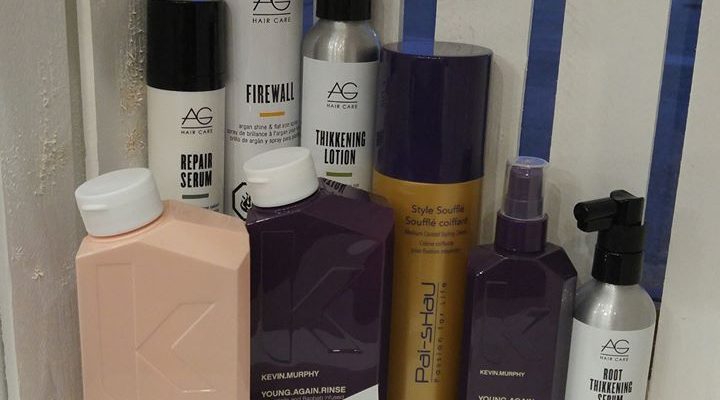
The image size is (720, 400). What are the coordinates of `blue strips on wall` in the screenshot? It's located at (307, 18), (413, 18), (536, 49), (675, 112).